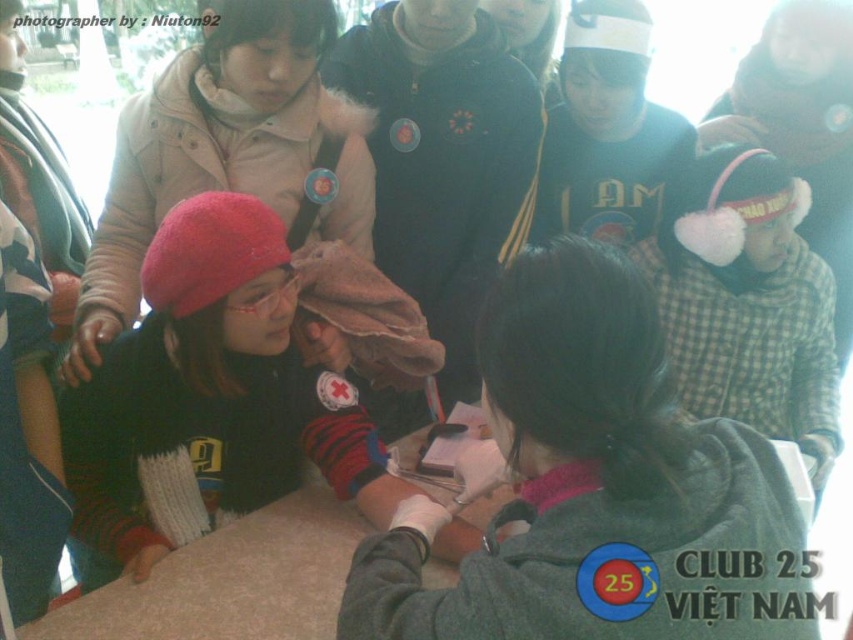
Looking at this image, you are organizing a charity event and need to place a decorative ribbon between the matte pink hat at left and the green cotton sweater at upper center. Which object should you place the ribbon closer to if you want it to be near the narrower item?

The green cotton sweater at upper center is narrower than the matte pink hat at left, so place the ribbon closer to the green cotton sweater at upper center.

You are organizing a charity event and need to place a decorative ribbon between the matte red beanie at left and the green cotton sweater at upper center. Based on their widths, which object should you place the ribbon next to to ensure it doesn not get covered?

The matte red beanie at left might be wider than green cotton sweater at upper center, so placing the ribbon next to the green cotton sweater at upper center would be better to avoid coverage.